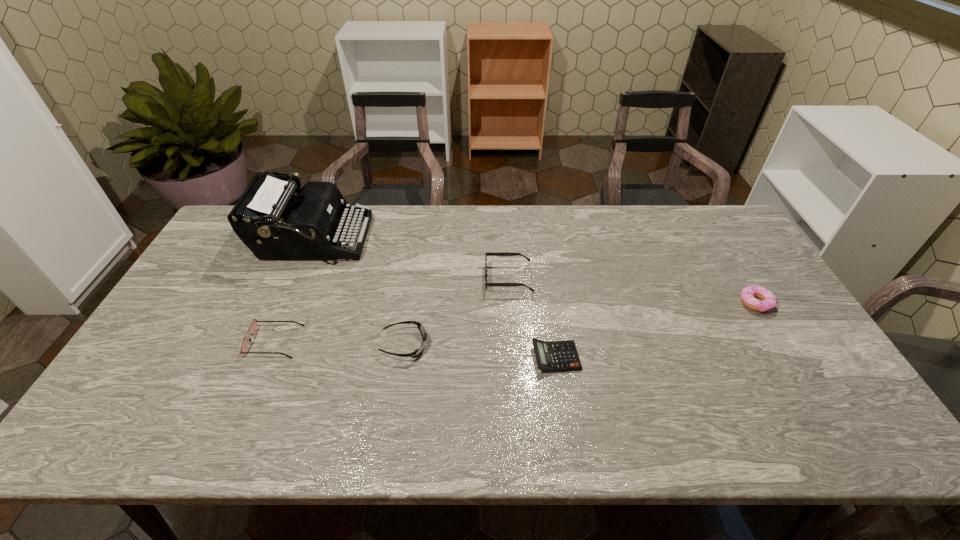
Find the location of a particular element. Image resolution: width=960 pixels, height=540 pixels. typewriter is located at coordinates (270, 220).

Image resolution: width=960 pixels, height=540 pixels. Find the location of `the tallest sunglasses`. the tallest sunglasses is located at coordinates (501, 253).

This screenshot has height=540, width=960. In order to click on the second tallest object in this screenshot , I will do `click(501, 253)`.

In order to click on the leftmost sunglasses in this screenshot , I will do pyautogui.click(x=253, y=327).

Image resolution: width=960 pixels, height=540 pixels. Find the location of `the rightmost object`. the rightmost object is located at coordinates (768, 300).

The image size is (960, 540). I want to click on the shortest sunglasses, so click(417, 352).

This screenshot has width=960, height=540. I want to click on the second sunglasses from right to left, so click(x=417, y=352).

Locate an element on the screen. The height and width of the screenshot is (540, 960). the shortest object is located at coordinates (557, 356).

Locate an element on the screen. Image resolution: width=960 pixels, height=540 pixels. free space located 0.140m on the typing side of the typewriter is located at coordinates (408, 240).

Find the location of a particular element. blank space located 0.060m at the front lenses of the rightmost sunglasses is located at coordinates (466, 278).